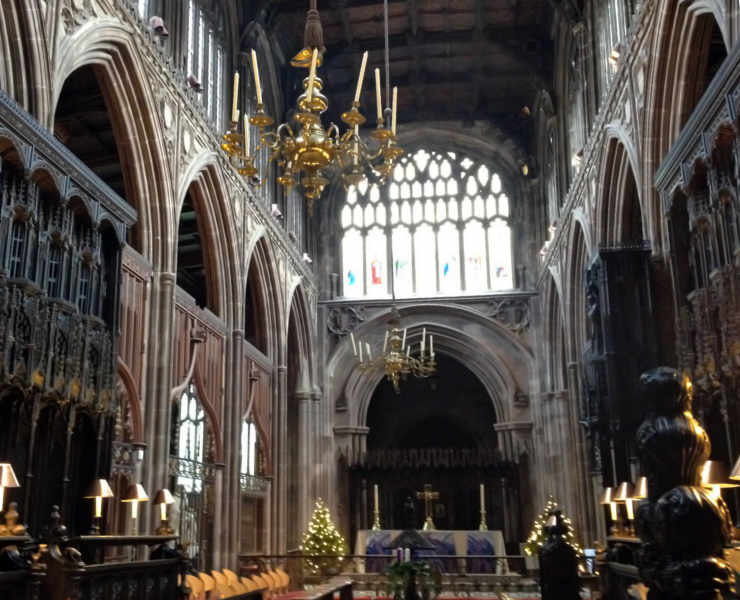
Identify the location of christmas trees. (322, 529), (551, 508).